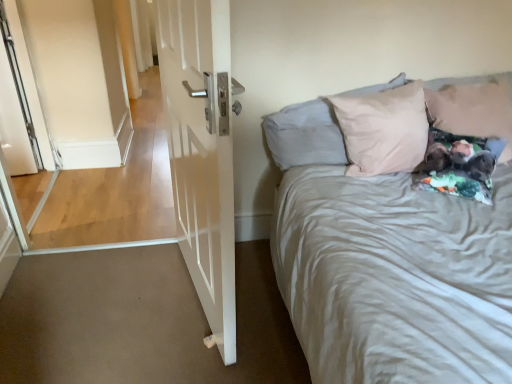
Question: Is white glossy door at left at the right side of light pink fabric pillow at upper right, which is the second pillow in left-to-right order?

Choices:
 (A) yes
 (B) no

Answer: (B)

Question: From a real-world perspective, is white glossy door at left beneath light pink fabric pillow at upper right, which is the second pillow in left-to-right order?

Choices:
 (A) no
 (B) yes

Answer: (B)

Question: Is white glossy door at left touching light pink fabric pillow at upper right, which is the second pillow in left-to-right order?

Choices:
 (A) yes
 (B) no

Answer: (B)

Question: Considering the relative positions of white glossy door at left and light pink fabric pillow at upper right, which is the second pillow in left-to-right order, in the image provided, is white glossy door at left in front of light pink fabric pillow at upper right, which is the second pillow in left-to-right order,?

Choices:
 (A) no
 (B) yes

Answer: (B)

Question: Can you confirm if white glossy door at left is smaller than light pink fabric pillow at upper right, which is the 1th pillow in right-to-left order?

Choices:
 (A) no
 (B) yes

Answer: (A)

Question: Is light pink fabric pillow at upper right, which is the second pillow in left-to-right order, bigger or smaller than white glossy door at left?

Choices:
 (A) big
 (B) small

Answer: (B)

Question: Is point 501,79 positioned closer to the camera than point 219,102?

Choices:
 (A) closer
 (B) farther

Answer: (B)

Question: In terms of width, does light pink fabric pillow at upper right, which is the 1th pillow in right-to-left order, look wider or thinner when compared to white glossy door at left?

Choices:
 (A) thin
 (B) wide

Answer: (B)

Question: Is light pink fabric pillow at upper right, which is the 1th pillow in right-to-left order, in front of or behind white glossy door at left in the image?

Choices:
 (A) behind
 (B) front

Answer: (A)

Question: Is point (276, 135) positioned closer to the camera than point (169, 52)?

Choices:
 (A) farther
 (B) closer

Answer: (A)

Question: From the image's perspective, relative to white glossy door at left, is light pink fabric pillow at upper right, arranged as the 1th pillow when viewed from the left, above or below?

Choices:
 (A) below
 (B) above

Answer: (B)

Question: Do you think light pink fabric pillow at upper right, the second pillow in the right-to-left sequence, is within white glossy door at left, or outside of it?

Choices:
 (A) outside
 (B) inside

Answer: (A)

Question: From a real-world perspective, is light pink fabric pillow at upper right, the second pillow in the right-to-left sequence, positioned above or below white glossy door at left?

Choices:
 (A) above
 (B) below

Answer: (A)

Question: Is white glossy door at left situated inside light pink fabric pillow at upper right, the second pillow in the right-to-left sequence, or outside?

Choices:
 (A) inside
 (B) outside

Answer: (B)

Question: Considering the positions of white glossy door at left and light pink fabric pillow at upper right, arranged as the 1th pillow when viewed from the left, in the image, is white glossy door at left wider or thinner than light pink fabric pillow at upper right, arranged as the 1th pillow when viewed from the left,?

Choices:
 (A) thin
 (B) wide

Answer: (A)